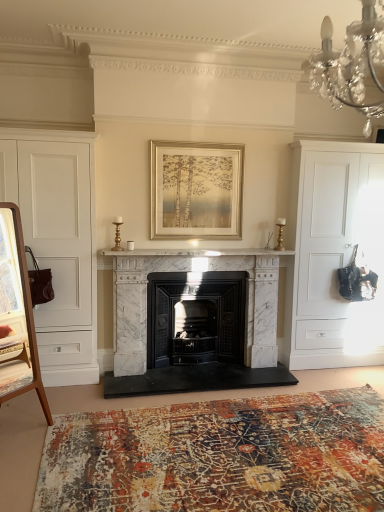
Image resolution: width=384 pixels, height=512 pixels. Identify the location of black cast iron fireplace at center, which appears as the 2th fireplace when viewed from the right. (196, 318).

Describe the element at coordinates (195, 252) in the screenshot. I see `white marble fireplace at center` at that location.

Locate an element on the screen. black cast iron fireplace at center, positioned as the 1th fireplace in left-to-right order is located at coordinates (196, 318).

Find the location of a particular element. Image resolution: width=384 pixels, height=512 pixels. mantle located above the white matte cabinet at right, which is counted as the 1th cabinetry, starting from the right (from the image's perspective) is located at coordinates (195, 252).

Considering the relative sizes of white marble fireplace at center and white matte cabinet at right, the second cabinetry when ordered from left to right, in the image provided, is white marble fireplace at center smaller than white matte cabinet at right, the second cabinetry when ordered from left to right,?

Correct, white marble fireplace at center occupies less space than white matte cabinet at right, the second cabinetry when ordered from left to right.

Is white marble fireplace at center positioned far away from white matte cabinet at right, which is counted as the 1th cabinetry, starting from the right?

No.

Measure the distance from white marble fireplace at center to white matte cabinet at right, the second cabinetry when ordered from left to right.

A distance of 31.44 inches exists between white marble fireplace at center and white matte cabinet at right, the second cabinetry when ordered from left to right.

Between white matte cabinet at left, which ranks as the second cabinetry in right-to-left order, and white matte cabinet at right, the second cabinetry when ordered from left to right, which one has larger width?

Wider between the two is white matte cabinet at right, the second cabinetry when ordered from left to right.

Is the position of white matte cabinet at left, the first cabinetry when ordered from left to right, more distant than that of white matte cabinet at right, the second cabinetry when ordered from left to right?

No.

Can you tell me how much white matte cabinet at left, which ranks as the second cabinetry in right-to-left order, and white matte cabinet at right, the second cabinetry when ordered from left to right, differ in facing direction?

white matte cabinet at left, which ranks as the second cabinetry in right-to-left order, and white matte cabinet at right, the second cabinetry when ordered from left to right, are facing 0.383 degrees away from each other.

From a real-world perspective, is white matte cabinet at left, which ranks as the second cabinetry in right-to-left order, physically below white matte cabinet at right, which is counted as the 1th cabinetry, starting from the right?

Yes, from a real-world perspective, white matte cabinet at left, which ranks as the second cabinetry in right-to-left order, is under white matte cabinet at right, which is counted as the 1th cabinetry, starting from the right.

Which is in front, point (242, 387) or point (301, 322)?

The point (242, 387) is closer.

Is white matte cabinet at right, which is counted as the 1th cabinetry, starting from the right, at the back of white marble fireplace at center, which ranks as the 1th fireplace in right-to-left order?

No, white marble fireplace at center, which ranks as the 1th fireplace in right-to-left order, is not facing the opposite direction of white matte cabinet at right, which is counted as the 1th cabinetry, starting from the right.

Between white marble fireplace at center, which ranks as the 1th fireplace in right-to-left order, and white matte cabinet at right, the second cabinetry when ordered from left to right, which one has smaller size?

white marble fireplace at center, which ranks as the 1th fireplace in right-to-left order.

Considering the sizes of objects white marble fireplace at center, acting as the 2th fireplace starting from the left, and white matte cabinet at right, which is counted as the 1th cabinetry, starting from the right, in the image provided, who is wider, white marble fireplace at center, acting as the 2th fireplace starting from the left, or white matte cabinet at right, which is counted as the 1th cabinetry, starting from the right,?

Wider between the two is white matte cabinet at right, which is counted as the 1th cabinetry, starting from the right.

Are black cast iron fireplace at center, positioned as the 1th fireplace in left-to-right order, and white marble fireplace at center making contact?

No, black cast iron fireplace at center, positioned as the 1th fireplace in left-to-right order, is not beside white marble fireplace at center.

Could you tell me if black cast iron fireplace at center, positioned as the 1th fireplace in left-to-right order, is facing white marble fireplace at center?

No, black cast iron fireplace at center, positioned as the 1th fireplace in left-to-right order, does not turn towards white marble fireplace at center.

Looking at this image, which object is positioned more to the right, black cast iron fireplace at center, which appears as the 2th fireplace when viewed from the right, or white marble fireplace at center?

white marble fireplace at center is more to the right.

Would you say white marble fireplace at center, which ranks as the 1th fireplace in right-to-left order, is inside or outside gold metallic picture frame at center?

white marble fireplace at center, which ranks as the 1th fireplace in right-to-left order, is not enclosed by gold metallic picture frame at center.

From the image's perspective, which one is positioned lower, white marble fireplace at center, acting as the 2th fireplace starting from the left, or gold metallic picture frame at center?

white marble fireplace at center, acting as the 2th fireplace starting from the left.

How different are the orientations of white marble fireplace at center, acting as the 2th fireplace starting from the left, and gold metallic picture frame at center in degrees?

The facing directions of white marble fireplace at center, acting as the 2th fireplace starting from the left, and gold metallic picture frame at center are 0.223 degrees apart.

Which of these two, white marble fireplace at center, acting as the 2th fireplace starting from the left, or gold metallic picture frame at center, stands taller?

Standing taller between the two is white marble fireplace at center, acting as the 2th fireplace starting from the left.

Do you think white matte cabinet at left, the first cabinetry when ordered from left to right, is within gold metallic picture frame at center, or outside of it?

white matte cabinet at left, the first cabinetry when ordered from left to right, lies outside gold metallic picture frame at center.

From a real-world perspective, which is physically above, white matte cabinet at left, which ranks as the second cabinetry in right-to-left order, or gold metallic picture frame at center?

In real-world perspective, gold metallic picture frame at center is above.

Where is `picture frame located behind the white matte cabinet at left, which ranks as the second cabinetry in right-to-left order`? picture frame located behind the white matte cabinet at left, which ranks as the second cabinetry in right-to-left order is located at coordinates (196, 190).

Is gold metallic picture frame at center not inside black cast iron fireplace at center, positioned as the 1th fireplace in left-to-right order?

Indeed, gold metallic picture frame at center is completely outside black cast iron fireplace at center, positioned as the 1th fireplace in left-to-right order.

Which is more to the right, gold metallic picture frame at center or black cast iron fireplace at center, positioned as the 1th fireplace in left-to-right order?

Positioned to the right is gold metallic picture frame at center.

Is gold metallic picture frame at center far from black cast iron fireplace at center, which appears as the 2th fireplace when viewed from the right?

No.

Where is `mantle above the white matte cabinet at right, the second cabinetry when ordered from left to right (from a real-world perspective)`? The width and height of the screenshot is (384, 512). mantle above the white matte cabinet at right, the second cabinetry when ordered from left to right (from a real-world perspective) is located at coordinates (195, 252).

Where is `cabinetry in front of the white matte cabinet at right, the second cabinetry when ordered from left to right`? This screenshot has height=512, width=384. cabinetry in front of the white matte cabinet at right, the second cabinetry when ordered from left to right is located at coordinates (58, 242).

Which object lies nearer to the anchor point white marble fireplace at center, acting as the 2th fireplace starting from the left, white matte cabinet at right, which is counted as the 1th cabinetry, starting from the right, or gold metallic picture frame at center?

gold metallic picture frame at center lies closer to white marble fireplace at center, acting as the 2th fireplace starting from the left, than the other object.

Based on their spatial positions, is white marble fireplace at center or gold metallic picture frame at center closer to white marble fireplace at center, acting as the 2th fireplace starting from the left?

white marble fireplace at center.

When comparing their distances from white matte cabinet at left, the first cabinetry when ordered from left to right, does textured rug at lower center or black cast iron fireplace at center, positioned as the 1th fireplace in left-to-right order, seem closer?

black cast iron fireplace at center, positioned as the 1th fireplace in left-to-right order.

When comparing their distances from white marble fireplace at center, acting as the 2th fireplace starting from the left, does gold metallic picture frame at center or textured rug at lower center seem closer?

gold metallic picture frame at center is positioned closer to the anchor white marble fireplace at center, acting as the 2th fireplace starting from the left.

Estimate the real-world distances between objects in this image. Which object is closer to white matte cabinet at right, the second cabinetry when ordered from left to right, textured rug at lower center or black cast iron fireplace at center, which appears as the 2th fireplace when viewed from the right?

Based on the image, black cast iron fireplace at center, which appears as the 2th fireplace when viewed from the right, appears to be nearer to white matte cabinet at right, the second cabinetry when ordered from left to right.

Estimate the real-world distances between objects in this image. Which object is further from white marble fireplace at center, gold metallic picture frame at center or black cast iron fireplace at center, which appears as the 2th fireplace when viewed from the right?

black cast iron fireplace at center, which appears as the 2th fireplace when viewed from the right, is positioned further to the anchor white marble fireplace at center.

Based on their spatial positions, is white marble fireplace at center or textured rug at lower center further from white matte cabinet at left, which ranks as the second cabinetry in right-to-left order?

textured rug at lower center lies further to white matte cabinet at left, which ranks as the second cabinetry in right-to-left order, than the other object.

Which object lies nearer to the anchor point white matte cabinet at right, which is counted as the 1th cabinetry, starting from the right, white marble fireplace at center or white marble fireplace at center, which ranks as the 1th fireplace in right-to-left order?

Among the two, white marble fireplace at center is located nearer to white matte cabinet at right, which is counted as the 1th cabinetry, starting from the right.

Locate an element on the screen. fireplace located between textured rug at lower center and gold metallic picture frame at center in the depth direction is located at coordinates (194, 339).

Locate an element on the screen. mantle positioned between textured rug at lower center and black cast iron fireplace at center, which appears as the 2th fireplace when viewed from the right, from near to far is located at coordinates (195, 252).

I want to click on mantle between textured rug at lower center and gold metallic picture frame at center from front to back, so click(195, 252).

Where is `fireplace between white marble fireplace at center and black cast iron fireplace at center, positioned as the 1th fireplace in left-to-right order, vertically`? The image size is (384, 512). fireplace between white marble fireplace at center and black cast iron fireplace at center, positioned as the 1th fireplace in left-to-right order, vertically is located at coordinates (194, 339).